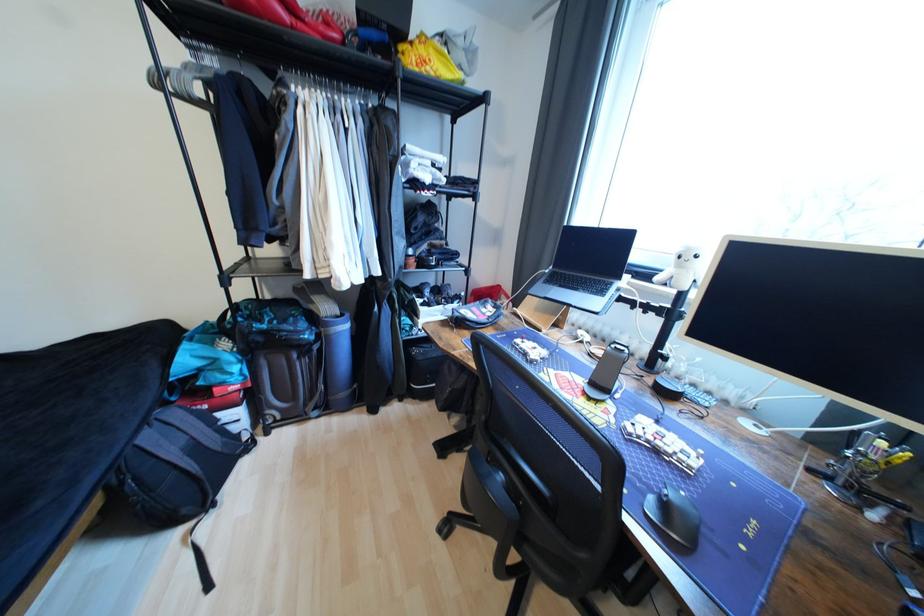
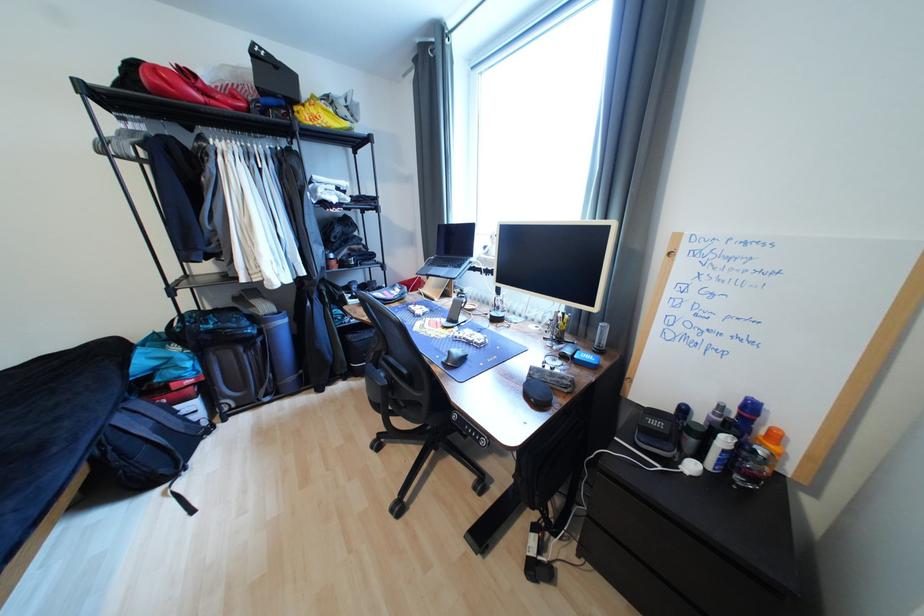
Question: How did the camera likely rotate?

Choices:
 (A) Left
 (B) Right
 (C) Up
 (D) Down

Answer: (B)